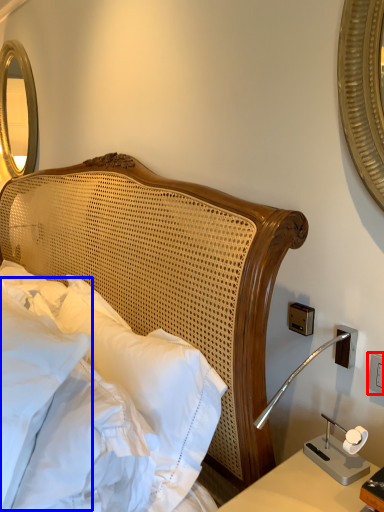
Question: Which point is closer to the camera, electric outlet (highlighted by a red box) or pillow (highlighted by a blue box)?

Choices:
 (A) electric outlet
 (B) pillow

Answer: (B)